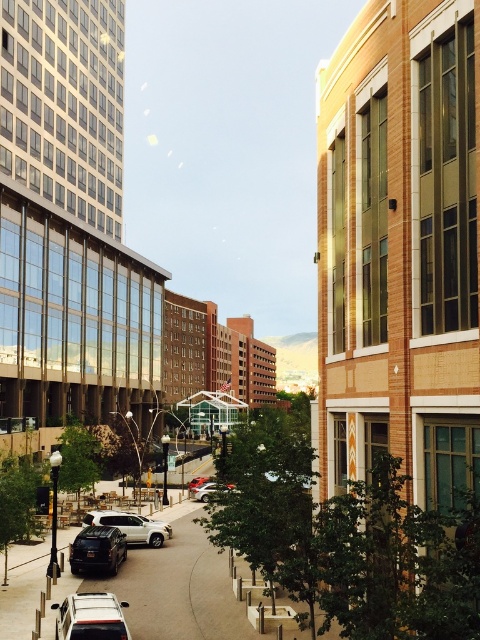
What do you see at coordinates (97, 548) in the screenshot? The image size is (480, 640). I see `shiny black suv at center` at bounding box center [97, 548].

Does shiny black suv at center have a larger size compared to white matte suv at center?

No, shiny black suv at center is not bigger than white matte suv at center.

This screenshot has width=480, height=640. What do you see at coordinates (97, 548) in the screenshot? I see `shiny black suv at center` at bounding box center [97, 548].

Find the location of `shiny black suv at center`. shiny black suv at center is located at coordinates point(97,548).

Measure the distance between shiny black suv at center and silver metallic car at center.

A distance of 5.64 meters exists between shiny black suv at center and silver metallic car at center.

Who is more forward, (x=99, y=556) or (x=197, y=499)?

Point (x=99, y=556) is in front.

Between point (85, 547) and point (203, 492), which one is positioned in front?

Point (85, 547) is in front.

The height and width of the screenshot is (640, 480). I want to click on shiny black suv at center, so click(97, 548).

Consider the image. Does silver metallic suv at lower left have a greater height compared to white matte suv at center?

In fact, silver metallic suv at lower left may be shorter than white matte suv at center.

Can you confirm if silver metallic suv at lower left is positioned above white matte suv at center?

Indeed, silver metallic suv at lower left is positioned over white matte suv at center.

What do you see at coordinates (91, 616) in the screenshot? This screenshot has height=640, width=480. I see `silver metallic suv at lower left` at bounding box center [91, 616].

Locate an element on the screen. silver metallic suv at lower left is located at coordinates (91, 616).